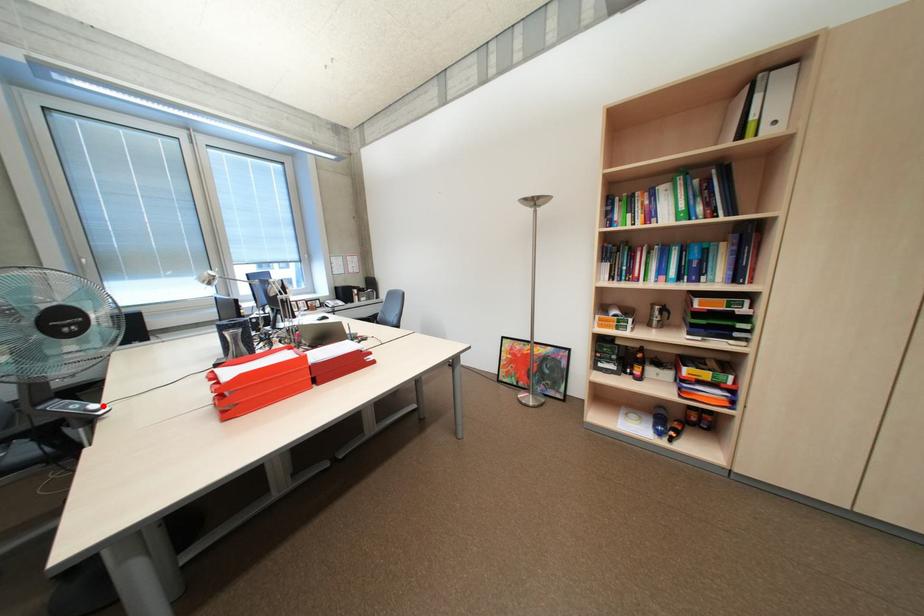
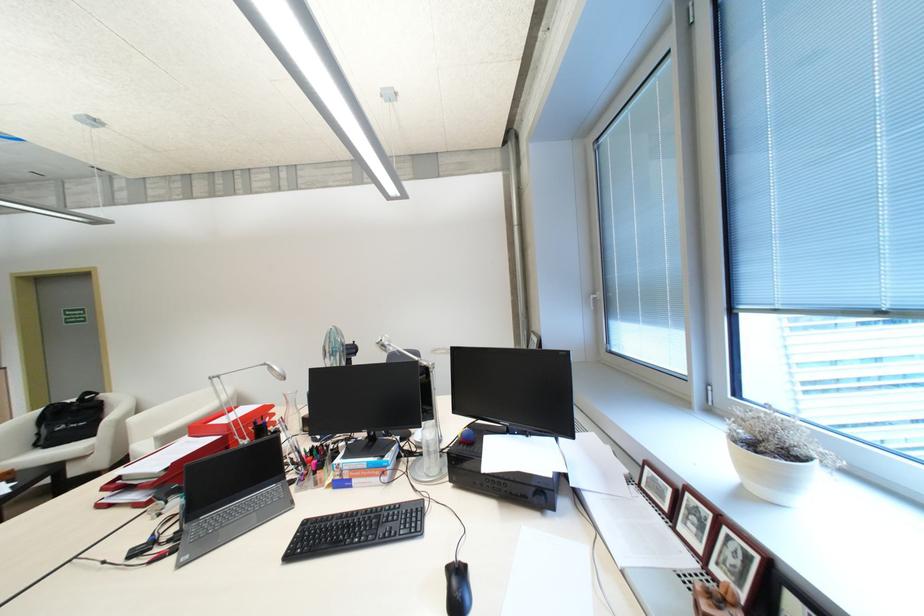
Question: I am providing you with two images of the same scene from different viewpoints. A red point is marked on the first image. Can you still see the location of the red point in image 2?

Choices:
 (A) Yes
 (B) No

Answer: (B)